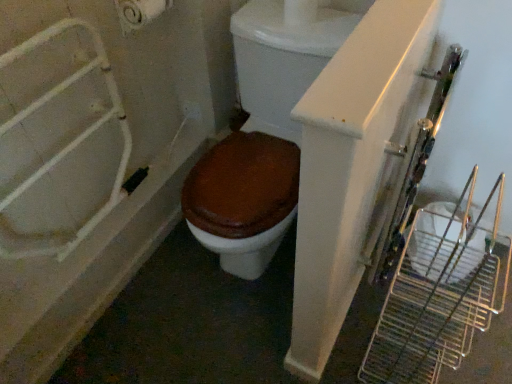
This screenshot has height=384, width=512. What do you see at coordinates (139, 12) in the screenshot? I see `white matte toilet paper at upper left` at bounding box center [139, 12].

In order to face white glossy bathtub at left, should I rotate leftwards or rightwards?

Turn left approximately 17.923 degrees to face it.

This screenshot has width=512, height=384. I want to click on white matte toilet paper at upper left, so click(139, 12).

Would you say white matte toilet paper at upper left is part of brown matte toilet at center's contents?

No, white matte toilet paper at upper left is not surrounded by brown matte toilet at center.

Based on the photo, is brown matte toilet at center directly adjacent to white matte toilet paper at upper left?

No.

From a real-world perspective, is brown matte toilet at center positioned under white matte toilet paper at upper left based on gravity?

Yes, from a real-world perspective, brown matte toilet at center is below white matte toilet paper at upper left.

Which is correct: brown matte toilet at center is inside white glossy bathtub at left, or outside of it?

brown matte toilet at center is outside white glossy bathtub at left.

From a real-world perspective, between brown matte toilet at center and white glossy bathtub at left, who is vertically lower?

white glossy bathtub at left is physically lower.

Does brown matte toilet at center come in front of white glossy bathtub at left?

Yes, brown matte toilet at center is in front of white glossy bathtub at left.

How different are the orientations of white matte toilet paper at upper left and brown matte toilet at center in degrees?

The facing directions of white matte toilet paper at upper left and brown matte toilet at center are 89.9 degrees apart.

Is white matte toilet paper at upper left bigger than brown matte toilet at center?

No.

Which of these two, white matte toilet paper at upper left or brown matte toilet at center, is wider?

brown matte toilet at center.

Is white matte toilet paper at upper left positioned beyond the bounds of brown matte toilet at center?

white matte toilet paper at upper left is positioned outside brown matte toilet at center.

Is white glossy bathtub at left positioned far away from brown matte toilet at center?

They are positioned close to each other.

Does white glossy bathtub at left contain brown matte toilet at center?

That's incorrect, brown matte toilet at center is not inside white glossy bathtub at left.

The height and width of the screenshot is (384, 512). What are the coordinates of `toilet above the white glossy bathtub at left (from the image's perspective)` in the screenshot? It's located at (262, 130).

Considering the relative sizes of white glossy bathtub at left and brown matte toilet at center in the image provided, is white glossy bathtub at left bigger than brown matte toilet at center?

Incorrect, white glossy bathtub at left is not larger than brown matte toilet at center.

Looking at this image, would you say white matte toilet paper at upper left is part of white glossy bathtub at left's contents?

No, white matte toilet paper at upper left is not a part of white glossy bathtub at left.

Which object is positioned more to the right, white glossy bathtub at left or white matte toilet paper at upper left?

Positioned to the right is white matte toilet paper at upper left.

Which object is more forward, white glossy bathtub at left or white matte toilet paper at upper left?

white glossy bathtub at left is closer to the camera.

From the image's perspective, would you say white glossy bathtub at left is positioned over white matte toilet paper at upper left?

Incorrect, from the image's perspective, white glossy bathtub at left is lower than white matte toilet paper at upper left.

From the image's perspective, is white matte toilet paper at upper left above or below white glossy bathtub at left?

Clearly, from the image's perspective, white matte toilet paper at upper left is above white glossy bathtub at left.

What's the angular difference between white matte toilet paper at upper left and white glossy bathtub at left's facing directions?

The facing directions of white matte toilet paper at upper left and white glossy bathtub at left are 90.2 degrees apart.

Looking at this image, which is farther from the camera, (125, 28) or (113, 9)?

The point (125, 28) is farther from the camera.

How distant is white matte toilet paper at upper left from white glossy bathtub at left?

white matte toilet paper at upper left is 17.22 inches from white glossy bathtub at left.

I want to click on toilet paper behind the brown matte toilet at center, so point(139,12).

In order to click on toilet in front of the white glossy bathtub at left in this screenshot , I will do `click(262, 130)`.

When comparing their distances from white matte toilet paper at upper left, does brown matte toilet at center or white glossy bathtub at left seem further?

The object further to white matte toilet paper at upper left is brown matte toilet at center.

Based on their spatial positions, is white glossy bathtub at left or brown matte toilet at center closer to white matte toilet paper at upper left?

white glossy bathtub at left is positioned closer to the anchor white matte toilet paper at upper left.

Which object lies further to the anchor point white glossy bathtub at left, brown matte toilet at center or white matte toilet paper at upper left?

white matte toilet paper at upper left lies further to white glossy bathtub at left than the other object.

Based on their spatial positions, is white matte toilet paper at upper left or white glossy bathtub at left further from brown matte toilet at center?

white matte toilet paper at upper left is further to brown matte toilet at center.

Which object lies further to the anchor point brown matte toilet at center, white glossy bathtub at left or white matte toilet paper at upper left?

white matte toilet paper at upper left lies further to brown matte toilet at center than the other object.

Which object lies nearer to the anchor point white glossy bathtub at left, white matte toilet paper at upper left or brown matte toilet at center?

Based on the image, brown matte toilet at center appears to be nearer to white glossy bathtub at left.

Identify the location of toilet between white matte toilet paper at upper left and white glossy bathtub at left vertically. Image resolution: width=512 pixels, height=384 pixels. (262, 130).